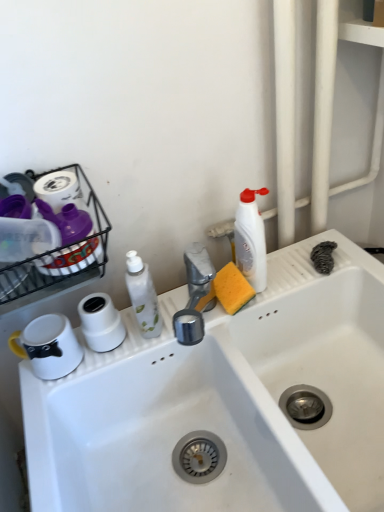
Question: From a real-world perspective, is white matte toilet paper at center physically above white plastic bottle at upper right, which is the first cleaning product in right-to-left order?

Choices:
 (A) no
 (B) yes

Answer: (A)

Question: Is white matte toilet paper at center directly adjacent to white plastic bottle at upper right, which is the first cleaning product in right-to-left order?

Choices:
 (A) yes
 (B) no

Answer: (B)

Question: From the image's perspective, is white matte toilet paper at center above white plastic bottle at upper right, which is the second cleaning product in left-to-right order?

Choices:
 (A) no
 (B) yes

Answer: (A)

Question: Can you confirm if white matte toilet paper at center is shorter than white plastic bottle at upper right, which is the second cleaning product in left-to-right order?

Choices:
 (A) yes
 (B) no

Answer: (A)

Question: Does white matte toilet paper at center have a smaller size compared to white plastic bottle at upper right, which is the first cleaning product in right-to-left order?

Choices:
 (A) no
 (B) yes

Answer: (B)

Question: Is white plastic bottle at upper right, which is the second cleaning product in left-to-right order, bigger or smaller than white glossy mug at left?

Choices:
 (A) big
 (B) small

Answer: (A)

Question: Looking at their shapes, would you say white plastic bottle at upper right, which is the second cleaning product in left-to-right order, is wider or thinner than white glossy mug at left?

Choices:
 (A) thin
 (B) wide

Answer: (A)

Question: Is point (251, 257) closer or farther from the camera than point (51, 342)?

Choices:
 (A) farther
 (B) closer

Answer: (A)

Question: In the image, is white plastic bottle at upper right, which is the second cleaning product in left-to-right order, positioned in front of or behind white glossy mug at left?

Choices:
 (A) front
 (B) behind

Answer: (B)

Question: From the image's perspective, is white matte toilet paper at center positioned above or below white glossy bottle at center, which is the 2th cleaning product from right to left?

Choices:
 (A) below
 (B) above

Answer: (A)

Question: In terms of size, does white matte toilet paper at center appear bigger or smaller than white glossy bottle at center, marked as the first cleaning product in a left-to-right arrangement?

Choices:
 (A) big
 (B) small

Answer: (B)

Question: Based on their positions, is white matte toilet paper at center located to the left or right of white glossy bottle at center, which is the 2th cleaning product from right to left?

Choices:
 (A) right
 (B) left

Answer: (B)

Question: Is white matte toilet paper at center taller or shorter than white glossy bottle at center, marked as the first cleaning product in a left-to-right arrangement?

Choices:
 (A) short
 (B) tall

Answer: (A)

Question: Is white glossy bottle at center, marked as the first cleaning product in a left-to-right arrangement, inside the boundaries of white glossy mug at left, or outside?

Choices:
 (A) inside
 (B) outside

Answer: (B)

Question: Is point (148, 275) positioned closer to the camera than point (34, 355)?

Choices:
 (A) farther
 (B) closer

Answer: (A)